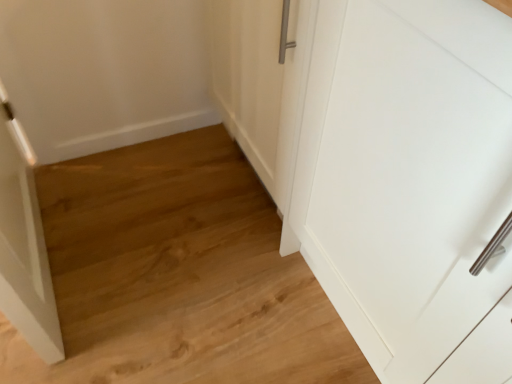
In order to click on white matte cupboard at right in this screenshot , I will do `click(384, 165)`.

The height and width of the screenshot is (384, 512). Describe the element at coordinates (384, 165) in the screenshot. I see `white matte cupboard at right` at that location.

Image resolution: width=512 pixels, height=384 pixels. Identify the location of white matte cupboard at right. (384, 165).